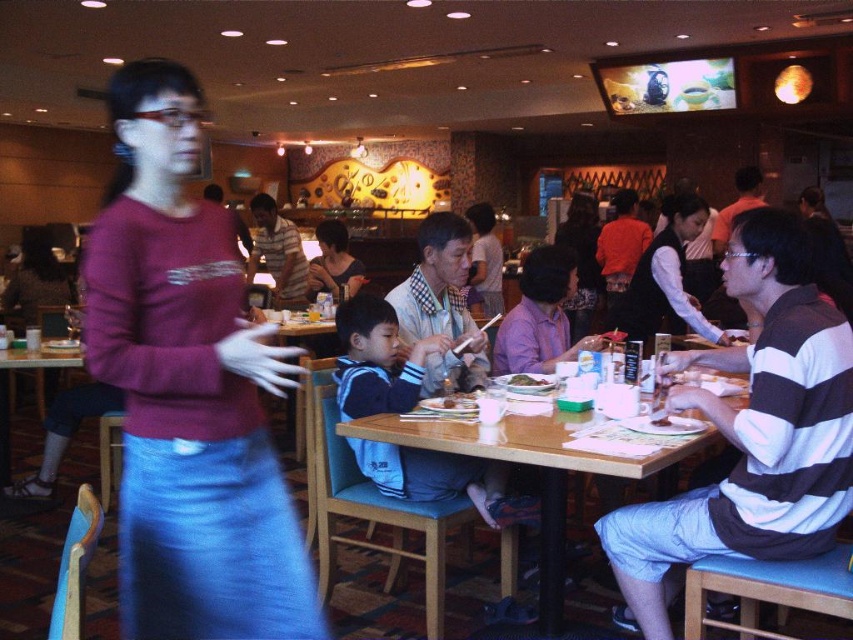
You are a photographer trying to capture a candid shot of the woman in the maroon sweater walking past the camera. You notice two points marked in the scene. One is at coordinates point (653, 529) and the other at point (271, 266). Which point is closer to the camera, and thus more likely to be in focus if you focus on that point?

Point (653, 529) is closer to the camera than point (271, 266), so focusing on it would likely keep the woman in focus.

You are a photographer standing at the camera position. You want to take a clear photo of the matte purple sweater at center. Considering the distance between you and the sweater, will you need to adjust your camera focus to capture it sharply?

The matte purple sweater at center and camera are 1.26 meters apart. To capture it sharply, you should adjust the camera focus to the distance of 1.26 meters.